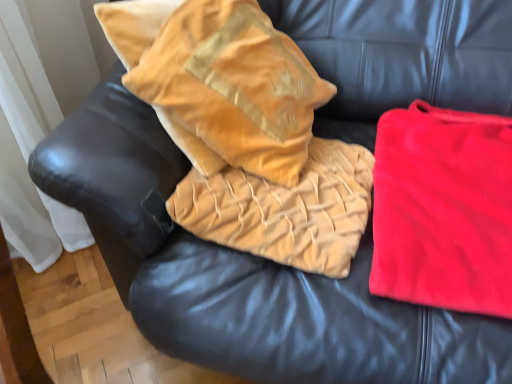
Question: Should I look upward or downward to see velvet gold pillow at center?

Choices:
 (A) down
 (B) up

Answer: (B)

Question: Does red velvet blanket at right contain velvet gold throw pillow at upper left?

Choices:
 (A) no
 (B) yes

Answer: (A)

Question: From the image's perspective, is red velvet blanket at right beneath velvet gold throw pillow at upper left?

Choices:
 (A) yes
 (B) no

Answer: (A)

Question: Is red velvet blanket at right thinner than velvet gold throw pillow at upper left?

Choices:
 (A) no
 (B) yes

Answer: (A)

Question: Can you see red velvet blanket at right touching velvet gold throw pillow at upper left?

Choices:
 (A) no
 (B) yes

Answer: (A)

Question: Is red velvet blanket at right positioned behind velvet gold throw pillow at upper left?

Choices:
 (A) yes
 (B) no

Answer: (B)

Question: From a real-world perspective, is red velvet blanket at right positioned over velvet gold throw pillow at upper left based on gravity?

Choices:
 (A) yes
 (B) no

Answer: (B)

Question: Is velvet gold pillow at center shorter than velvet gold throw pillow at upper left?

Choices:
 (A) yes
 (B) no

Answer: (A)

Question: Does velvet gold pillow at center have a smaller size compared to velvet gold throw pillow at upper left?

Choices:
 (A) yes
 (B) no

Answer: (A)

Question: Does velvet gold pillow at center appear on the right side of velvet gold throw pillow at upper left?

Choices:
 (A) yes
 (B) no

Answer: (A)

Question: From a real-world perspective, does velvet gold pillow at center sit lower than velvet gold throw pillow at upper left?

Choices:
 (A) no
 (B) yes

Answer: (B)

Question: From the image's perspective, is velvet gold pillow at center beneath velvet gold throw pillow at upper left?

Choices:
 (A) no
 (B) yes

Answer: (B)

Question: Is velvet gold pillow at center taller than velvet gold throw pillow at upper left?

Choices:
 (A) yes
 (B) no

Answer: (B)

Question: Is velvet gold throw pillow at upper left closer to the viewer compared to velvet gold pillow at center?

Choices:
 (A) yes
 (B) no

Answer: (A)